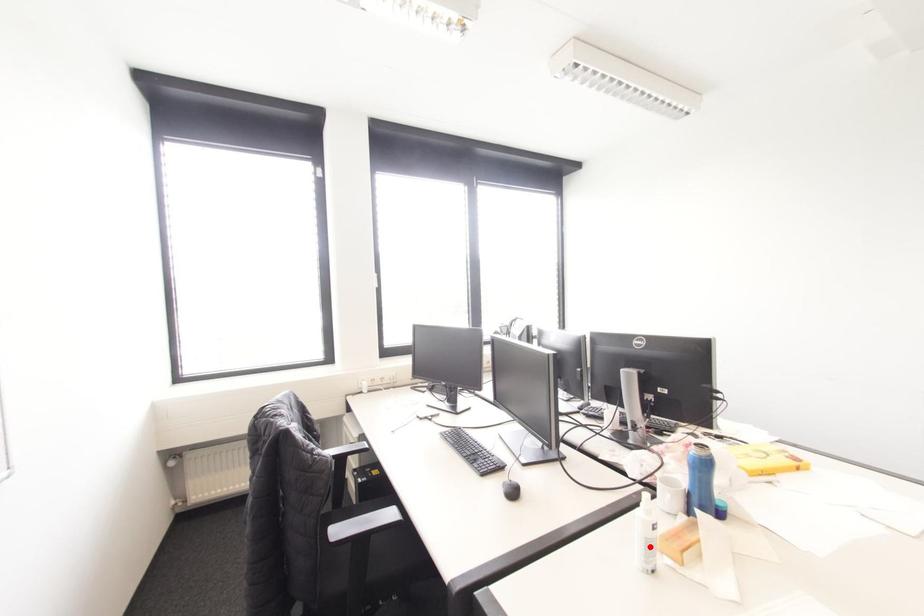
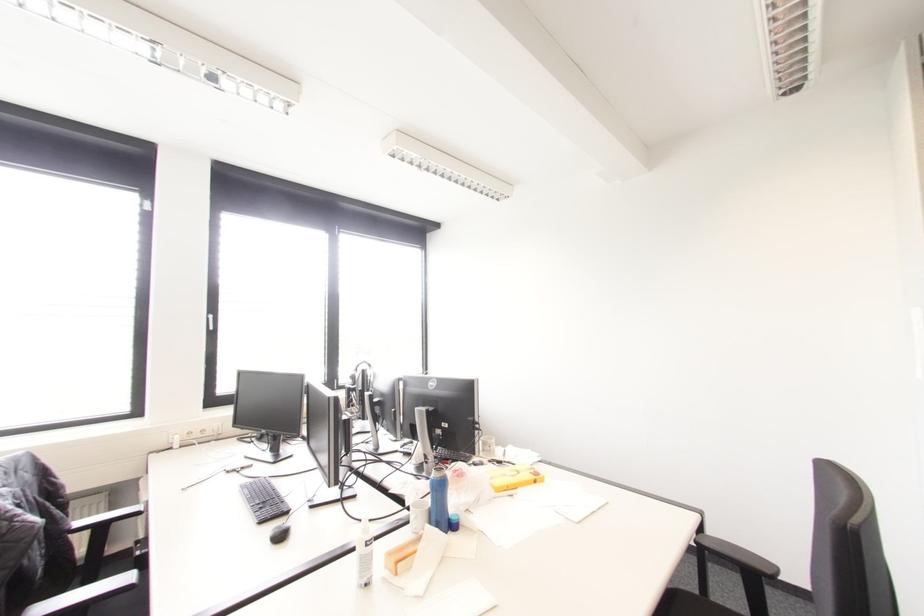
Find the pixel in the second image that matches the highlighted location in the first image.

(365, 562)